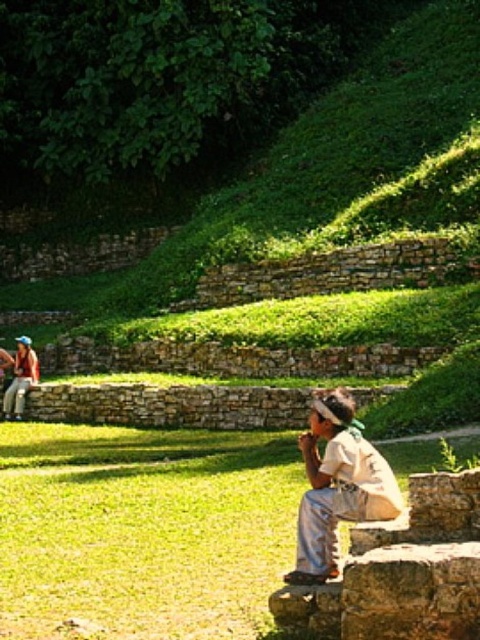
You are standing at the origin point of the coordinate system in this image. You want to walk to the green grass at lower left. What are the coordinates you should head towards?

The coordinates for the green grass at lower left are at point [144,531], so you should head towards those coordinates.